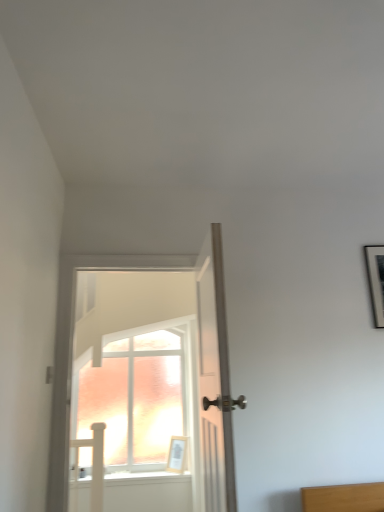
Question: Is white glossy door at center, the second door when ordered from right to left, taller than light wood picture frame at center?

Choices:
 (A) yes
 (B) no

Answer: (A)

Question: Does white glossy door at center, the second door when ordered from right to left, appear on the left side of light wood picture frame at center?

Choices:
 (A) yes
 (B) no

Answer: (A)

Question: Does white glossy door at center, acting as the 1th door starting from the left, have a greater width compared to light wood picture frame at center?

Choices:
 (A) no
 (B) yes

Answer: (B)

Question: Is white glossy door at center, the second door when ordered from right to left, surrounding light wood picture frame at center?

Choices:
 (A) yes
 (B) no

Answer: (B)

Question: Can you confirm if white glossy door at center, the second door when ordered from right to left, is shorter than light wood picture frame at center?

Choices:
 (A) no
 (B) yes

Answer: (A)

Question: From the image's perspective, is white glossy door at center, the second door when ordered from right to left, located beneath light wood picture frame at center?

Choices:
 (A) yes
 (B) no

Answer: (B)

Question: From the image's perspective, is white wooden door at center, the second door positioned from the left, over white glossy door at center, the second door when ordered from right to left?

Choices:
 (A) yes
 (B) no

Answer: (A)

Question: Can you confirm if white wooden door at center, the second door positioned from the left, is thinner than white glossy door at center, acting as the 1th door starting from the left?

Choices:
 (A) no
 (B) yes

Answer: (B)

Question: Considering the relative sizes of white wooden door at center, the second door positioned from the left, and white glossy door at center, acting as the 1th door starting from the left, in the image provided, is white wooden door at center, the second door positioned from the left, wider than white glossy door at center, acting as the 1th door starting from the left,?

Choices:
 (A) no
 (B) yes

Answer: (A)

Question: Is white wooden door at center, which is the 1th door from right to left, bigger than white glossy door at center, the second door when ordered from right to left?

Choices:
 (A) no
 (B) yes

Answer: (A)

Question: Considering the relative positions of white wooden door at center, the second door positioned from the left, and white glossy door at center, the second door when ordered from right to left, in the image provided, is white wooden door at center, the second door positioned from the left, to the right of white glossy door at center, the second door when ordered from right to left, from the viewer's perspective?

Choices:
 (A) yes
 (B) no

Answer: (A)

Question: From a real-world perspective, does white wooden door at center, the second door positioned from the left, stand above white glossy door at center, acting as the 1th door starting from the left?

Choices:
 (A) no
 (B) yes

Answer: (A)

Question: Does white glossy door at center, acting as the 1th door starting from the left, turn towards white wooden door at center, which is the 1th door from right to left?

Choices:
 (A) no
 (B) yes

Answer: (B)